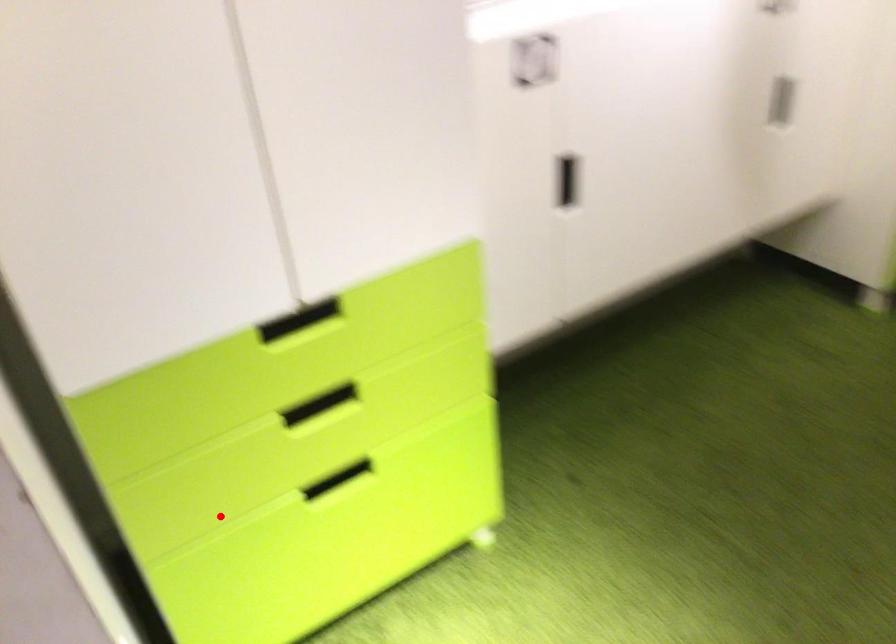
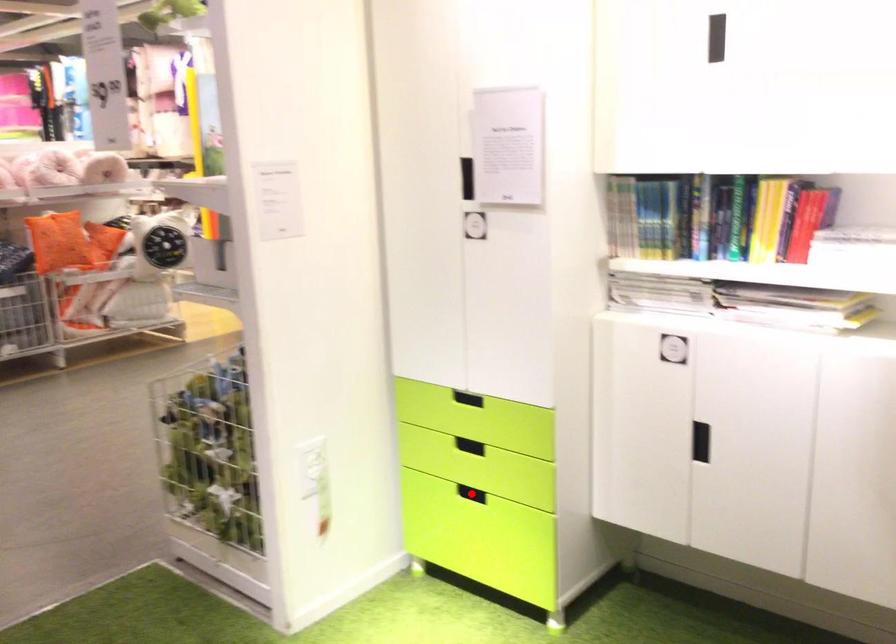
I am providing you with two images of the same scene from different viewpoints. A red point is marked on the first image and another point is marked on the second image. Is the marked point in image1 the same physical position as the marked point in image2?

Yes